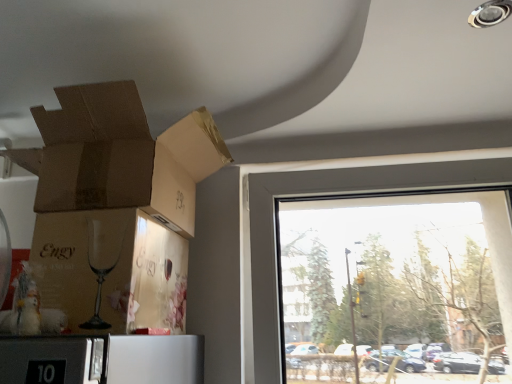
Question: Is transparent glass window at right not inside matte brown cardboard at lower left, acting as the 1th cardboard box starting from the bottom?

Choices:
 (A) no
 (B) yes

Answer: (B)

Question: Is transparent glass window at right to the right of matte brown cardboard at lower left, acting as the 2th cardboard box starting from the top, from the viewer's perspective?

Choices:
 (A) no
 (B) yes

Answer: (B)

Question: Is transparent glass window at right closer to camera compared to matte brown cardboard at lower left, acting as the 1th cardboard box starting from the bottom?

Choices:
 (A) yes
 (B) no

Answer: (B)

Question: Can you confirm if transparent glass window at right is smaller than matte brown cardboard at lower left, acting as the 1th cardboard box starting from the bottom?

Choices:
 (A) yes
 (B) no

Answer: (B)

Question: Is transparent glass window at right positioned far away from matte brown cardboard at lower left, acting as the 2th cardboard box starting from the top?

Choices:
 (A) yes
 (B) no

Answer: (B)

Question: From the image's perspective, is transparent glass window at right above or below matte brown cardboard at lower left, acting as the 2th cardboard box starting from the top?

Choices:
 (A) below
 (B) above

Answer: (A)

Question: Based on their positions, is transparent glass window at right located to the left or right of matte brown cardboard at lower left, acting as the 2th cardboard box starting from the top?

Choices:
 (A) right
 (B) left

Answer: (A)

Question: Considering the positions of point (317, 168) and point (169, 231), is point (317, 168) closer or farther from the camera than point (169, 231)?

Choices:
 (A) closer
 (B) farther

Answer: (B)

Question: Is transparent glass window at right taller or shorter than matte brown cardboard at lower left, acting as the 2th cardboard box starting from the top?

Choices:
 (A) tall
 (B) short

Answer: (A)

Question: From a real-world perspective, is brown cardboard box at upper left, marked as the first cardboard box in a top-to-bottom arrangement, physically located above or below matte brown cardboard at lower left, acting as the 1th cardboard box starting from the bottom?

Choices:
 (A) below
 (B) above

Answer: (B)

Question: In the image, is brown cardboard box at upper left, marked as the first cardboard box in a top-to-bottom arrangement, positioned in front of or behind matte brown cardboard at lower left, acting as the 1th cardboard box starting from the bottom?

Choices:
 (A) behind
 (B) front

Answer: (A)

Question: Considering the positions of brown cardboard box at upper left, marked as the first cardboard box in a top-to-bottom arrangement, and matte brown cardboard at lower left, acting as the 2th cardboard box starting from the top, in the image, is brown cardboard box at upper left, marked as the first cardboard box in a top-to-bottom arrangement, wider or thinner than matte brown cardboard at lower left, acting as the 2th cardboard box starting from the top,?

Choices:
 (A) thin
 (B) wide

Answer: (B)

Question: Is point (111, 120) closer or farther from the camera than point (172, 317)?

Choices:
 (A) farther
 (B) closer

Answer: (B)

Question: Is transparent glass window at right taller or shorter than brown cardboard box at upper left, which is the second cardboard box from bottom to top?

Choices:
 (A) short
 (B) tall

Answer: (B)

Question: Considering the positions of transparent glass window at right and brown cardboard box at upper left, which is the second cardboard box from bottom to top, in the image, is transparent glass window at right wider or thinner than brown cardboard box at upper left, which is the second cardboard box from bottom to top,?

Choices:
 (A) thin
 (B) wide

Answer: (A)